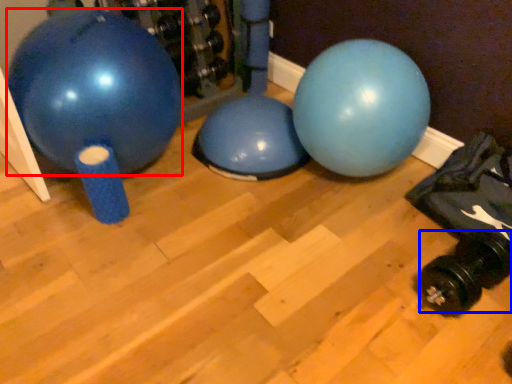
Question: Which point is closer to the camera, ball (highlighted by a red box) or dumbbell (highlighted by a blue box)?

Choices:
 (A) ball
 (B) dumbbell

Answer: (B)